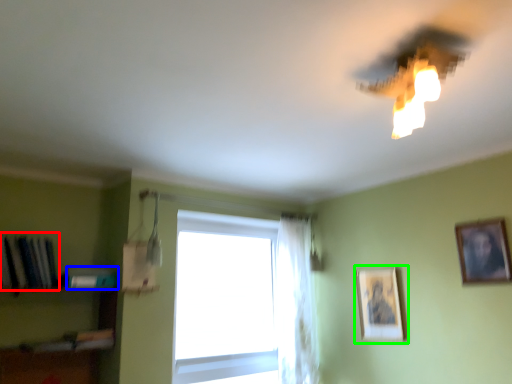
Question: Which object is positioned closest to book (highlighted by a red box)? Select from book (highlighted by a blue box) and picture frame (highlighted by a green box).

Choices:
 (A) book
 (B) picture frame

Answer: (A)